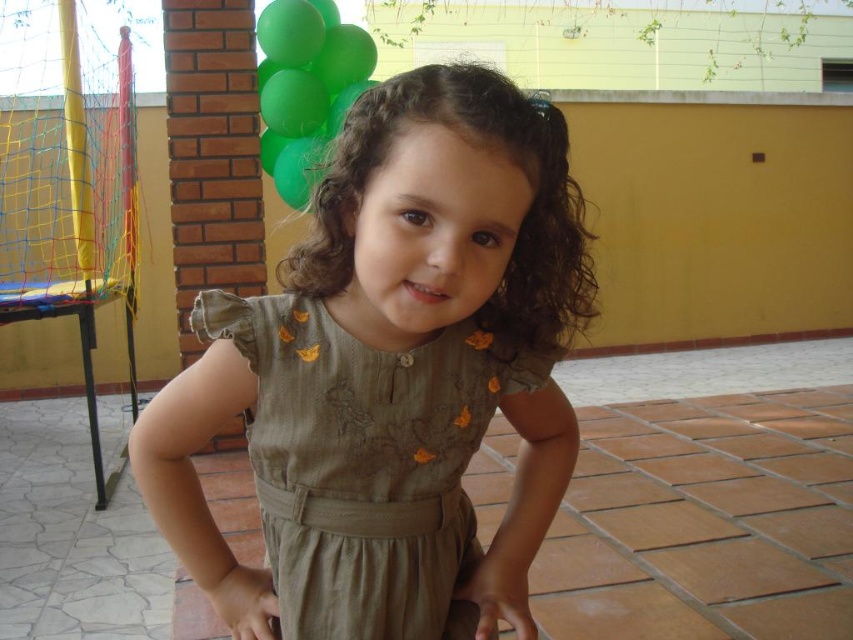
Question: Is olive green fabric dress at center to the right of green matte balloon at upper left from the viewer's perspective?

Choices:
 (A) yes
 (B) no

Answer: (A)

Question: Is olive green fabric dress at center bigger than green matte balloon at upper left?

Choices:
 (A) no
 (B) yes

Answer: (A)

Question: Is olive green fabric dress at center wider than green matte balloon at upper left?

Choices:
 (A) yes
 (B) no

Answer: (B)

Question: Which object is positioned closest to the green matte balloon at upper left?

Choices:
 (A) olive green fabric dress at center
 (B) matte green dress at center

Answer: (A)

Question: Based on their relative distances, which object is nearer to the matte green dress at center?

Choices:
 (A) olive green fabric dress at center
 (B) green matte balloon at upper left

Answer: (A)

Question: Which is nearer to the olive green fabric dress at center?

Choices:
 (A) matte green dress at center
 (B) green matte balloon at upper left

Answer: (A)